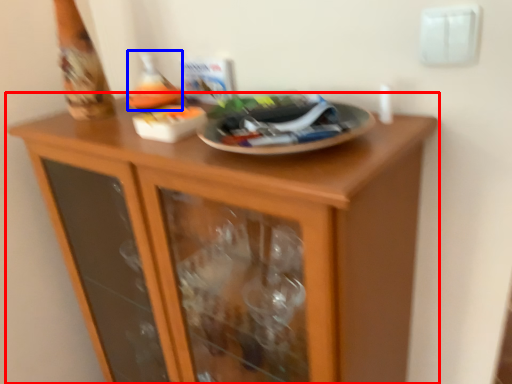
Question: Which object is further to the camera taking this photo, cupboard (highlighted by a red box) or wine bottle (highlighted by a blue box)?

Choices:
 (A) cupboard
 (B) wine bottle

Answer: (B)